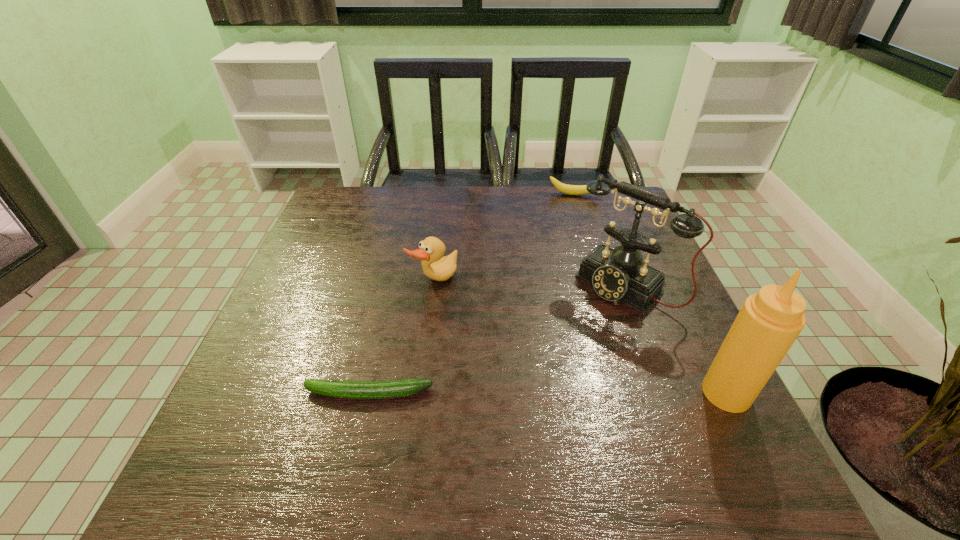
This screenshot has height=540, width=960. In the image, there is a desktop. Find the location of `free space at the near edge`. free space at the near edge is located at coordinates (466, 439).

Find the location of a particular element. This screenshot has height=540, width=960. vacant space at the left edge is located at coordinates pos(301,332).

At what (x,y) coordinates should I click in order to perform the action: click on vacant space at the right edge. Please return your answer as a coordinate pair (x, y). Looking at the image, I should click on (599, 234).

The width and height of the screenshot is (960, 540). I want to click on free location at the far left corner, so click(344, 221).

Image resolution: width=960 pixels, height=540 pixels. Identify the location of free spot at the far right corner of the desktop. (608, 211).

In the image, there is a desktop. Identify the location of vacant space at the near right corner. (648, 410).

The width and height of the screenshot is (960, 540). In order to click on free space between the duck and the condiment in this screenshot , I will do `click(580, 338)`.

Where is `free spot between the farthest object and the zucchini`? free spot between the farthest object and the zucchini is located at coordinates (471, 294).

This screenshot has height=540, width=960. Identify the location of free space between the second tallest object and the shortest object. (496, 340).

Find the location of a particular element. Image resolution: width=960 pixels, height=540 pixels. free spot between the shortest object and the condiment is located at coordinates (547, 393).